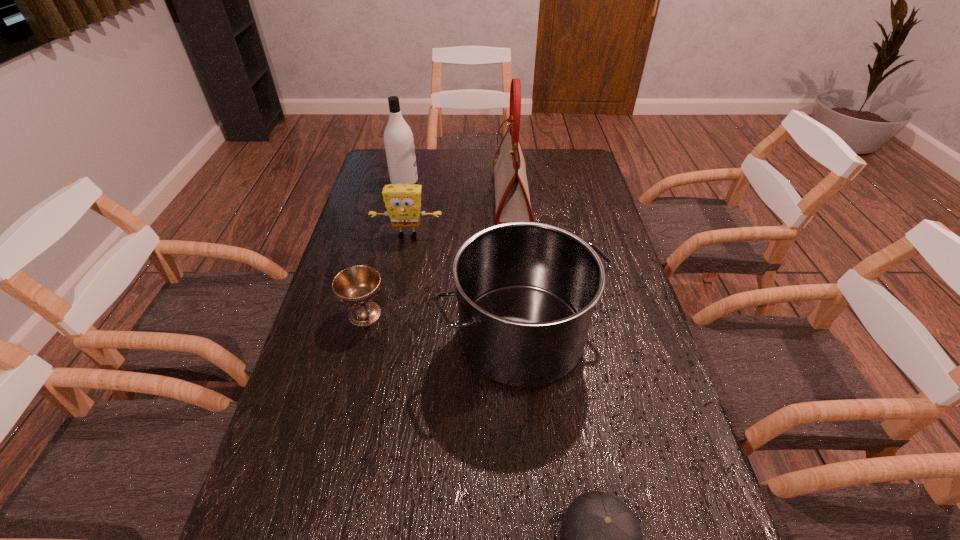
This screenshot has width=960, height=540. Identify the location of handbag that is at the far edge. (512, 200).

Find the location of a particular element. Image resolution: width=960 pixels, height=540 pixels. shampoo at the far edge is located at coordinates (398, 138).

The width and height of the screenshot is (960, 540). I want to click on shampoo situated at the left edge, so click(x=398, y=138).

Identify the location of sponge at the left edge. The width and height of the screenshot is (960, 540). (403, 202).

This screenshot has height=540, width=960. Find the location of `chalice that is at the left edge`. chalice that is at the left edge is located at coordinates (357, 286).

Image resolution: width=960 pixels, height=540 pixels. Find the location of `object at the right edge`. object at the right edge is located at coordinates (526, 291).

Identify the location of object present at the far left corner. (398, 138).

At what (x,y) coordinates should I click in order to perform the action: click on vacant region at the far edge of the desktop. Please return your answer as a coordinate pair (x, y). Looking at the image, I should click on (495, 151).

Where is `free space at the left edge of the desktop`? Image resolution: width=960 pixels, height=540 pixels. free space at the left edge of the desktop is located at coordinates (388, 250).

You are a GUI agent. You are given a task and a screenshot of the screen. Output one action in this format:
    pyautogui.click(x=<x>, y=<y>)
    Task: Click on the vacant space at the right edge
    This screenshot has width=960, height=540.
    Given the screenshot: What is the action you would take?
    pyautogui.click(x=561, y=181)